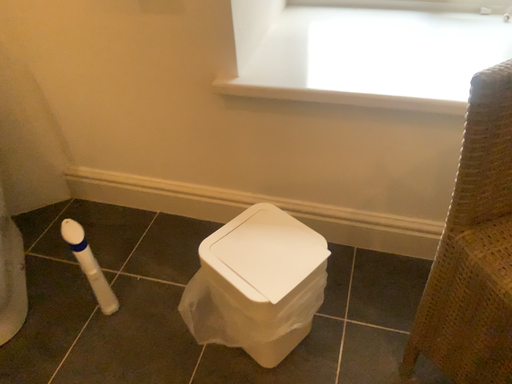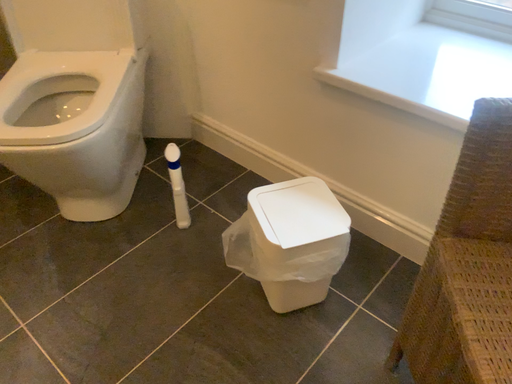
Question: How did the camera likely rotate when shooting the video?

Choices:
 (A) rotated left
 (B) rotated right

Answer: (A)